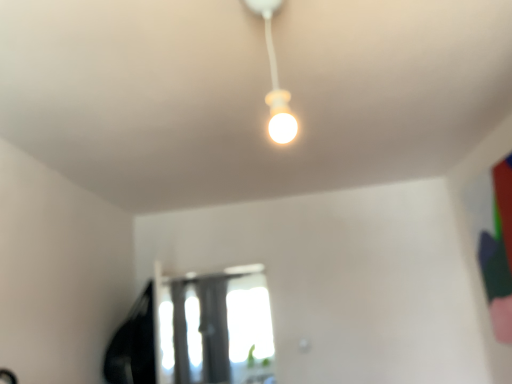
Identify the location of matte white bulb at center. (275, 80).

This screenshot has height=384, width=512. What do you see at coordinates (275, 80) in the screenshot?
I see `matte white bulb at center` at bounding box center [275, 80].

You are a GUI agent. You are given a task and a screenshot of the screen. Output one action in this format:
    pyautogui.click(x=<x>, y=<y>)
    Task: Click on the transparent glass window at center
    The image size is (512, 384).
    Given the screenshot: What is the action you would take?
    pyautogui.click(x=214, y=327)

What do you see at coordinates (214, 327) in the screenshot?
I see `transparent glass window at center` at bounding box center [214, 327].

What is the approximate width of transparent glass window at center?

The width of transparent glass window at center is 8.71 centimeters.

Where is `matte white bulb at center`? Image resolution: width=512 pixels, height=384 pixels. matte white bulb at center is located at coordinates (275, 80).

Which is more to the right, matte white bulb at center or transparent glass window at center?

From the viewer's perspective, matte white bulb at center appears more on the right side.

Does matte white bulb at center come in front of transparent glass window at center?

That is True.

Is point (280, 94) positioned behind point (220, 309)?

That is False.

From the image's perspective, which object appears higher, matte white bulb at center or transparent glass window at center?

matte white bulb at center is shown above in the image.

From a real-world perspective, is matte white bulb at center physically above transparent glass window at center?

Yes.

Is matte white bulb at center thinner than transparent glass window at center?

No.

From the picture: Is matte white bulb at center shorter than transparent glass window at center?

Correct, matte white bulb at center is not as tall as transparent glass window at center.

Based on their sizes in the image, would you say matte white bulb at center is bigger or smaller than transparent glass window at center?

Considering their sizes, matte white bulb at center takes up less space than transparent glass window at center.

Is matte white bulb at center inside or outside of transparent glass window at center?

matte white bulb at center lies outside transparent glass window at center.

Is matte white bulb at center in contact with transparent glass window at center?

matte white bulb at center is not next to transparent glass window at center, and they're not touching.

Is matte white bulb at center aimed at transparent glass window at center?

No, matte white bulb at center is not facing towards transparent glass window at center.

How many degrees apart are the facing directions of matte white bulb at center and transparent glass window at center?

The angle between the facing direction of matte white bulb at center and the facing direction of transparent glass window at center is 178 degrees.

Image resolution: width=512 pixels, height=384 pixels. I want to click on window behind the matte white bulb at center, so click(x=214, y=327).

Which object is positioned more to the right, transparent glass window at center or matte white bulb at center?

matte white bulb at center is more to the right.

Between transparent glass window at center and matte white bulb at center, which one is positioned in front?

matte white bulb at center.

Considering the positions of point (197, 366) and point (266, 17), is point (197, 366) closer or farther from the camera than point (266, 17)?

Point (197, 366) appears to be farther away from the viewer than point (266, 17).

From the image's perspective, would you say transparent glass window at center is positioned over matte white bulb at center?

No, from the image's perspective, transparent glass window at center is not above matte white bulb at center.

From a real-world perspective, between transparent glass window at center and matte white bulb at center, who is vertically higher?

matte white bulb at center.

Does transparent glass window at center have a lesser width compared to matte white bulb at center?

Indeed, transparent glass window at center has a lesser width compared to matte white bulb at center.

Which of these two, transparent glass window at center or matte white bulb at center, stands shorter?

Standing shorter between the two is matte white bulb at center.

From the picture: Does transparent glass window at center have a larger size compared to matte white bulb at center?

Indeed, transparent glass window at center has a larger size compared to matte white bulb at center.

Choose the correct answer: Is transparent glass window at center inside matte white bulb at center or outside it?

transparent glass window at center is spatially situated outside matte white bulb at center.

Are transparent glass window at center and matte white bulb at center located far from each other?

transparent glass window at center is positioned a significant distance from matte white bulb at center.

Is matte white bulb at center at the back of transparent glass window at center?

transparent glass window at center does not have its back to matte white bulb at center.

Can you tell me how much transparent glass window at center and matte white bulb at center differ in facing direction?

178 degrees.

Locate an element on the screen. The width and height of the screenshot is (512, 384). window below the matte white bulb at center (from a real-world perspective) is located at coordinates (x=214, y=327).

Image resolution: width=512 pixels, height=384 pixels. Find the location of `lamp in front of the transparent glass window at center`. lamp in front of the transparent glass window at center is located at coordinates tap(275, 80).

In the image, there is a matte white bulb at center. Identify the location of window below it (from a real-world perspective). This screenshot has width=512, height=384. (214, 327).